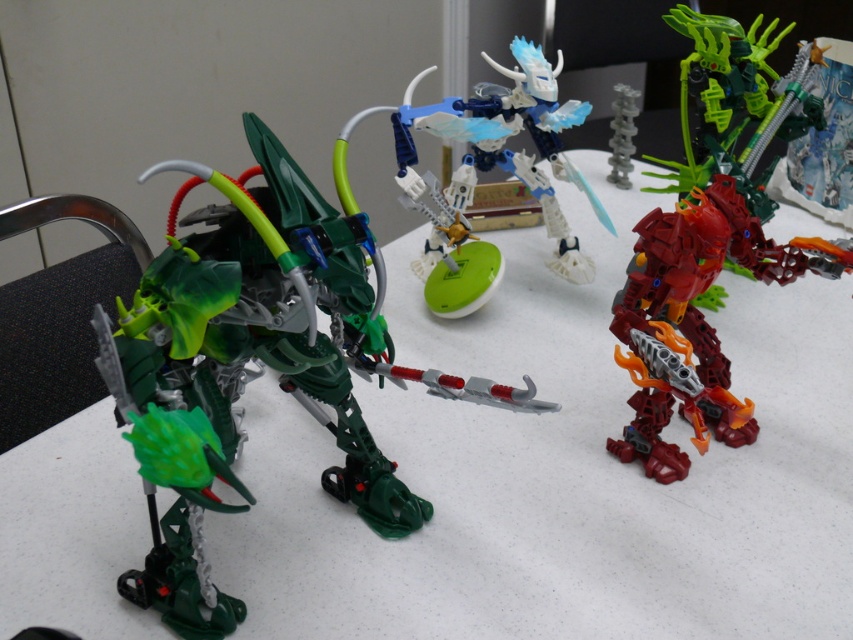
You are holding a camera and want to take a photo of the green plastic robot at left. If the camera has a minimum focus distance of 20 inches, will you be able to focus on the robot?

The green plastic robot at left and camera are 21.35 inches apart from each other, which is beyond the camera minimum focus distance of 20 inches. Therefore, you can focus on the robot.

You are a collector who wants to display both the shiny red plastic robot at right and the translucent gray spine at center on a shelf. Which one should you place first to ensure they both fit?

The shiny red plastic robot at right is larger than the translucent gray spine at center, so you should place the shiny red plastic robot at right first to accommodate its size.

You are a collector who wants to place a new 12 inch tall statue between the shiny red plastic robot at right and the translucent gray spine at center. Is there enough space between them to fit the statue?

The distance between the shiny red plastic robot at right and the translucent gray spine at center is 27.64 inches. Since the statue is 12 inches tall, there is sufficient space between them to accommodate it.